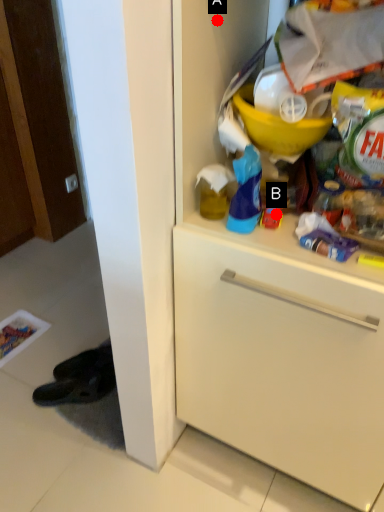
Question: Two points are circled on the image, labeled by A and B beside each circle. Which point is closer to the camera?

Choices:
 (A) A is closer
 (B) B is closer

Answer: (A)